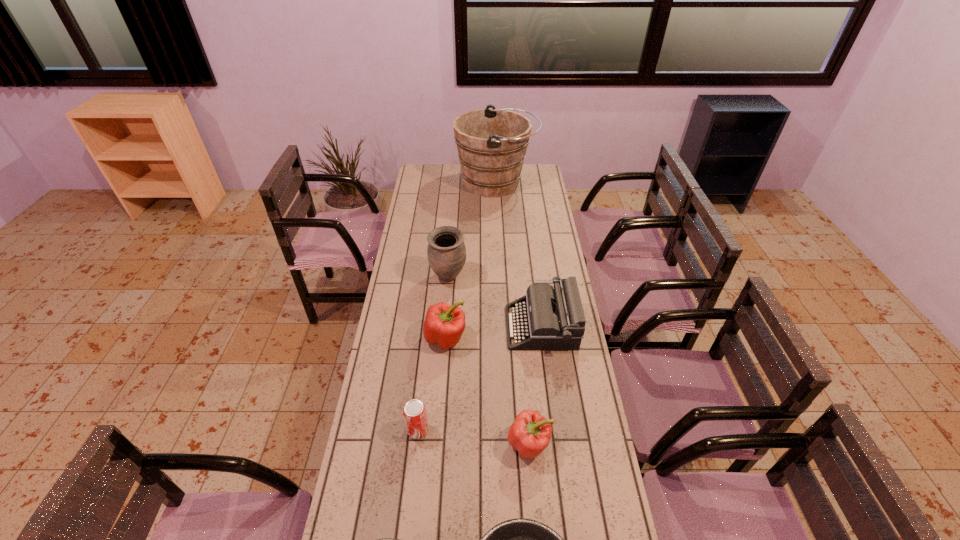
Where is `the farthest object`? This screenshot has width=960, height=540. the farthest object is located at coordinates (491, 143).

Where is `bucket`? bucket is located at coordinates (491, 143).

Find the location of `urn`. urn is located at coordinates (446, 251).

Identify the location of the second farthest object. This screenshot has height=540, width=960. [446, 251].

Locate an element on the screen. This screenshot has height=540, width=960. typewriter is located at coordinates (545, 319).

Locate an element on the screen. The width and height of the screenshot is (960, 540). the farther bell pepper is located at coordinates (444, 324).

This screenshot has height=540, width=960. Find the location of `the left bell pepper`. the left bell pepper is located at coordinates (444, 324).

At what (x,y) coordinates should I click in order to perform the action: click on the shorter bell pepper. Please return your answer as a coordinate pair (x, y). The image size is (960, 540). Looking at the image, I should click on (530, 433).

The image size is (960, 540). In order to click on the nearer bell pepper in this screenshot , I will do `click(530, 433)`.

Identify the location of soda can. (414, 412).